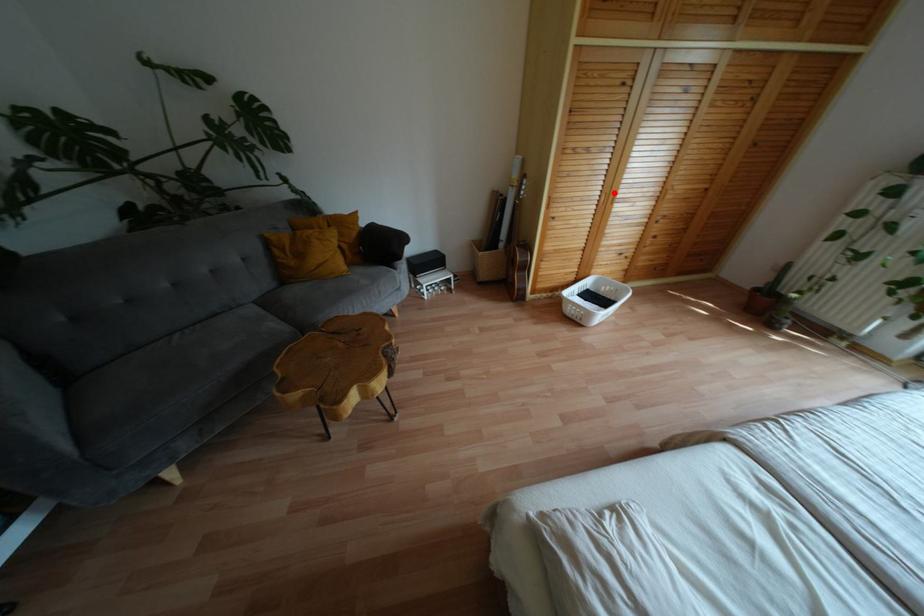
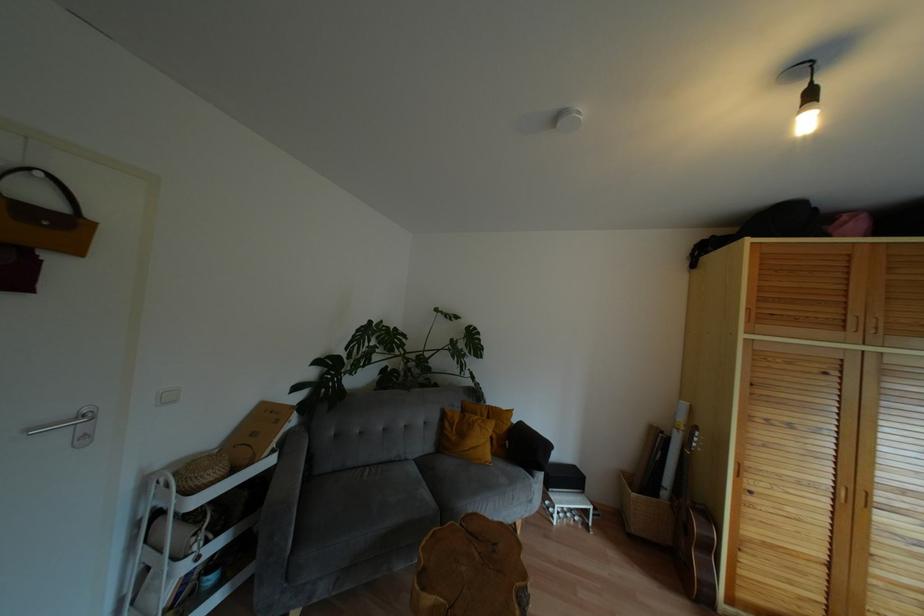
The point at the highlighted location is marked in the first image. Where is the corresponding point in the second image?

(867, 493)